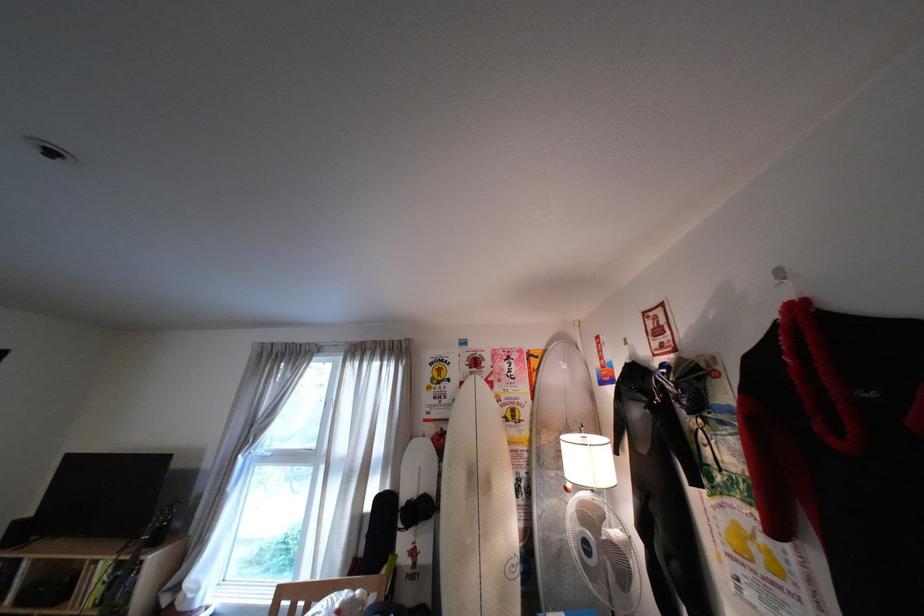
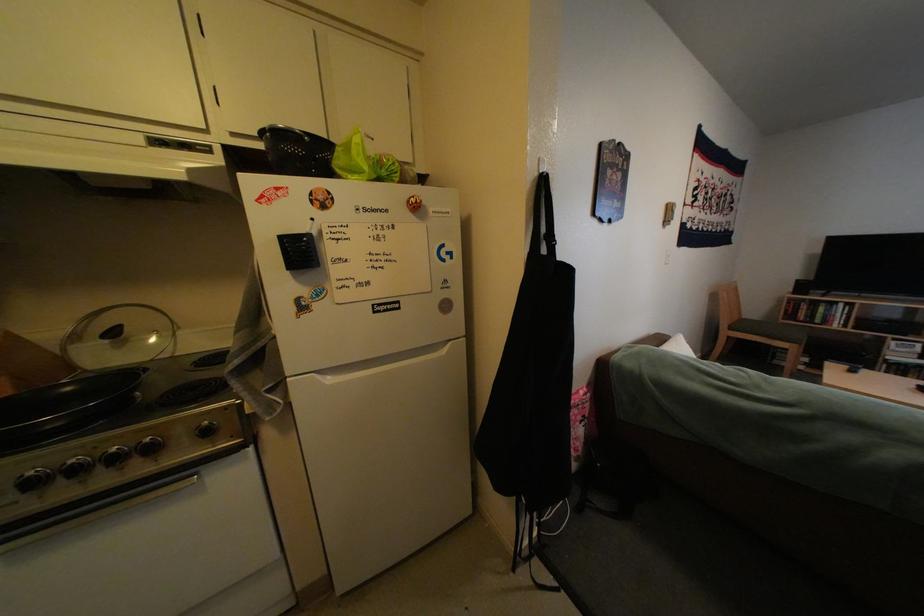
Locate, in the second image, the point that corresponds to (x=35, y=532) in the first image.

(816, 288)